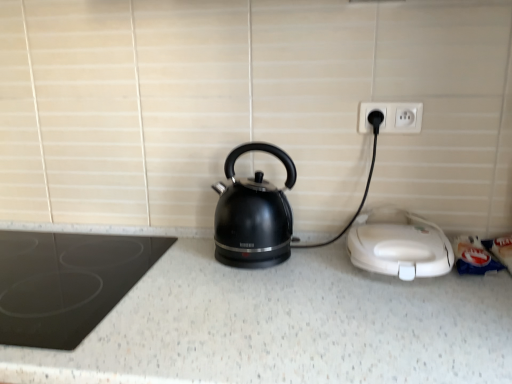
Locate an element on the screen. vacant space in front of white plastic sandwich maker at lower right, which is the first home appliance in right-to-left order is located at coordinates (418, 311).